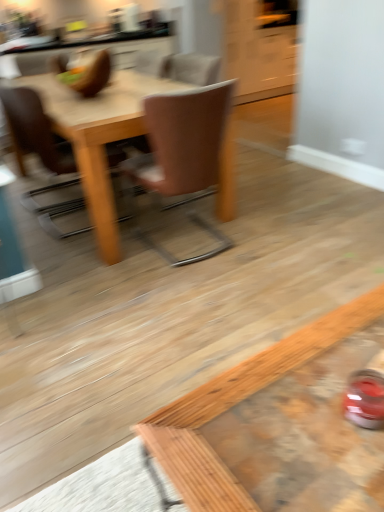
Question: In the image, is brown leather chair at upper left, acting as the second chair starting from the right, positioned in front of or behind wooden coffee table at lower right?

Choices:
 (A) front
 (B) behind

Answer: (B)

Question: From a real-world perspective, relative to wooden coffee table at lower right, is brown leather chair at upper left, the first chair in the left-to-right sequence, vertically above or below?

Choices:
 (A) above
 (B) below

Answer: (A)

Question: Estimate the real-world distances between objects in this image. Which object is closer to the light brown wooden table at center?

Choices:
 (A) brown leather chair at upper left, the first chair in the left-to-right sequence
 (B) white glossy cabinet at upper center
 (C) brown leather chair at center, which is the first chair from right to left
 (D) wooden coffee table at lower right

Answer: (C)

Question: Which object is positioned farthest from the brown leather chair at center, which is the 2th chair from left to right?

Choices:
 (A) light brown wooden table at center
 (B) wooden coffee table at lower right
 (C) white glossy cabinet at upper center
 (D) brown leather chair at upper left, the first chair in the left-to-right sequence

Answer: (C)